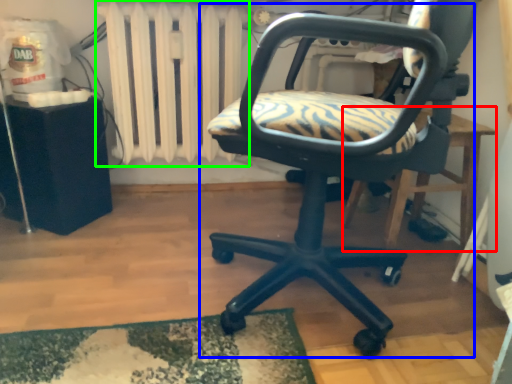
Question: Based on their relative distances, which object is farther from table (highlighted by a red box)? Choose from chair (highlighted by a blue box) and radiator (highlighted by a green box).

Choices:
 (A) chair
 (B) radiator

Answer: (B)